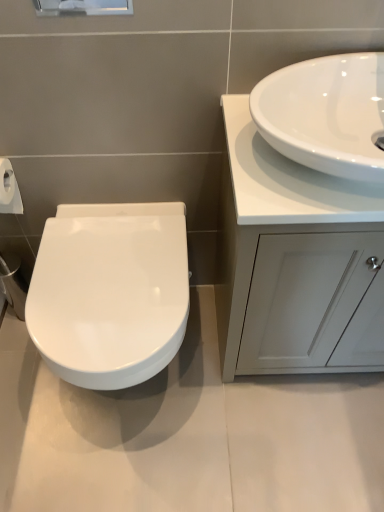
Question: Could you tell me if white glossy sink at upper right is facing white glossy cabinet at right?

Choices:
 (A) yes
 (B) no

Answer: (B)

Question: Would you say white glossy sink at upper right is outside white glossy cabinet at right?

Choices:
 (A) no
 (B) yes

Answer: (B)

Question: Is white glossy sink at upper right not close to white glossy cabinet at right?

Choices:
 (A) no
 (B) yes

Answer: (A)

Question: Does white glossy sink at upper right have a greater width compared to white glossy cabinet at right?

Choices:
 (A) yes
 (B) no

Answer: (B)

Question: Is white glossy sink at upper right next to white glossy cabinet at right?

Choices:
 (A) yes
 (B) no

Answer: (B)

Question: Would you say white glossy toilet at left is inside or outside white glossy sink at upper right?

Choices:
 (A) outside
 (B) inside

Answer: (A)

Question: Considering the positions of point (114, 205) and point (324, 83), is point (114, 205) closer or farther from the camera than point (324, 83)?

Choices:
 (A) farther
 (B) closer

Answer: (A)

Question: Is white glossy toilet at left in front of or behind white glossy sink at upper right in the image?

Choices:
 (A) behind
 (B) front

Answer: (A)

Question: From a real-world perspective, is white glossy toilet at left physically located above or below white glossy sink at upper right?

Choices:
 (A) above
 (B) below

Answer: (B)

Question: Choose the correct answer: Is white glossy cabinet at right inside white glossy toilet at left or outside it?

Choices:
 (A) inside
 (B) outside

Answer: (B)

Question: Considering the relative positions of white glossy cabinet at right and white glossy toilet at left in the image provided, is white glossy cabinet at right to the left or to the right of white glossy toilet at left?

Choices:
 (A) right
 (B) left

Answer: (A)

Question: From the image's perspective, is white glossy cabinet at right located above or below white glossy toilet at left?

Choices:
 (A) below
 (B) above

Answer: (B)

Question: From a real-world perspective, is white glossy cabinet at right positioned above or below white glossy toilet at left?

Choices:
 (A) above
 (B) below

Answer: (A)

Question: From a real-world perspective, is white glossy sink at upper right positioned above or below white glossy cabinet at right?

Choices:
 (A) below
 (B) above

Answer: (B)

Question: Is white glossy sink at upper right taller or shorter than white glossy cabinet at right?

Choices:
 (A) tall
 (B) short

Answer: (B)